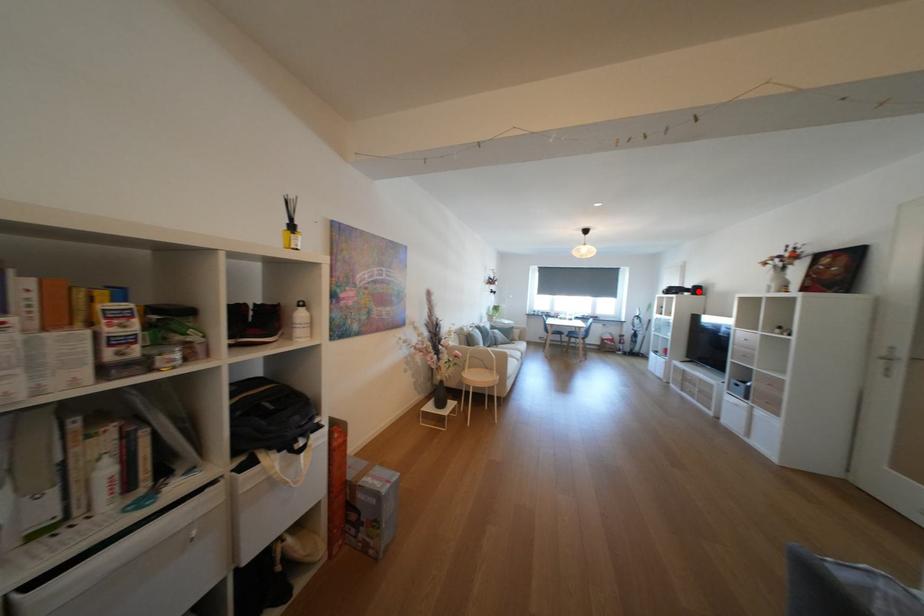
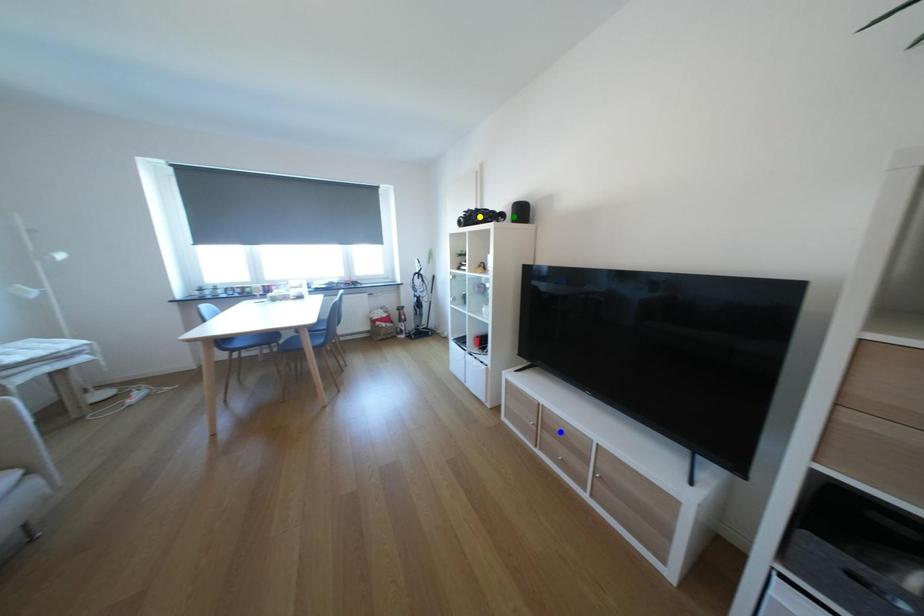
Question: I am providing you with two images of the same scene from different viewpoints. A red point is marked on the first image. You are given multiple points on the second image. Which mark in image 2 goes with the point in image 1?

Choices:
 (A) yellow point
 (B) green point
 (C) blue point

Answer: (B)